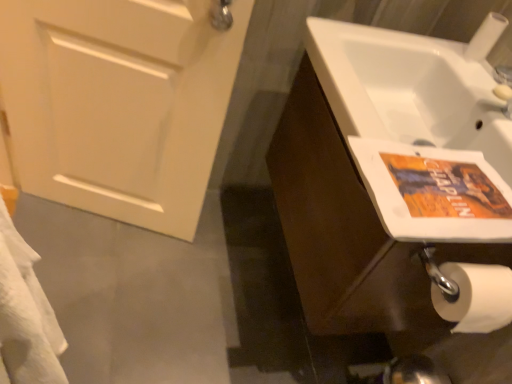
Question: Considering the positions of point tap(392, 183) and point tap(295, 81), is point tap(392, 183) closer or farther from the camera than point tap(295, 81)?

Choices:
 (A) closer
 (B) farther

Answer: (A)

Question: Choose the correct answer: Is orange paper flyer at right inside brown wood cabinet at right or outside it?

Choices:
 (A) outside
 (B) inside

Answer: (A)

Question: Based on their relative distances, which object is farther from the white matte door at left?

Choices:
 (A) white matte toilet paper at lower right
 (B) brown wood cabinet at right
 (C) orange paper flyer at right

Answer: (A)

Question: Based on their relative distances, which object is nearer to the orange paper flyer at right?

Choices:
 (A) brown wood cabinet at right
 (B) white matte toilet paper at lower right
 (C) white matte door at left

Answer: (A)